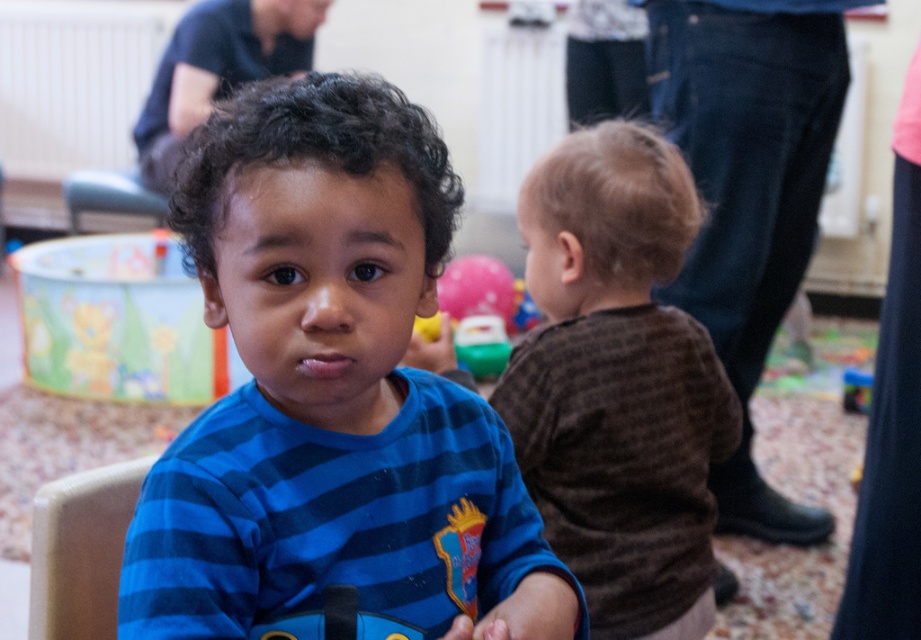
Is blue striped shirt at center wider than brown textured shirt at center?

Incorrect, blue striped shirt at center's width does not surpass brown textured shirt at center's.

Which is in front, point (257, 624) or point (498, 413)?

Point (257, 624)

Is point (369, 285) behind point (573, 198)?

That is False.

At what (x,y) coordinates should I click in order to perform the action: click on blue striped shirt at center. Please return your answer as a coordinate pair (x, y). Looking at the image, I should click on (331, 397).

Between point (197, 138) and point (855, 376), which one is positioned behind?

Point (855, 376)

Can you confirm if blue striped shirt at center is positioned below blue plastic toy at lower right?

Incorrect, blue striped shirt at center is not positioned below blue plastic toy at lower right.

Who is more forward, (175, 481) or (857, 408)?

Point (175, 481) is more forward.

Where is `blue striped shirt at center`? blue striped shirt at center is located at coordinates (331, 397).

What do you see at coordinates (616, 381) in the screenshot? This screenshot has height=640, width=921. I see `brown textured shirt at center` at bounding box center [616, 381].

Between brown textured shirt at center and pink rubber balloon at upper center, which one has less height?

pink rubber balloon at upper center

Does point (612, 276) come farther from viewer compared to point (469, 362)?

No, (612, 276) is closer to viewer.

What are the coordinates of `brown textured shirt at center` in the screenshot? It's located at (616, 381).